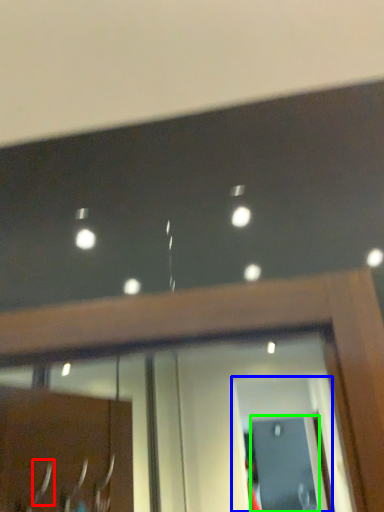
Question: Which is nearer to the door handle (highlighted by a red box)? screen door (highlighted by a blue box) or screen door (highlighted by a green box).

Choices:
 (A) screen door
 (B) screen door

Answer: (A)